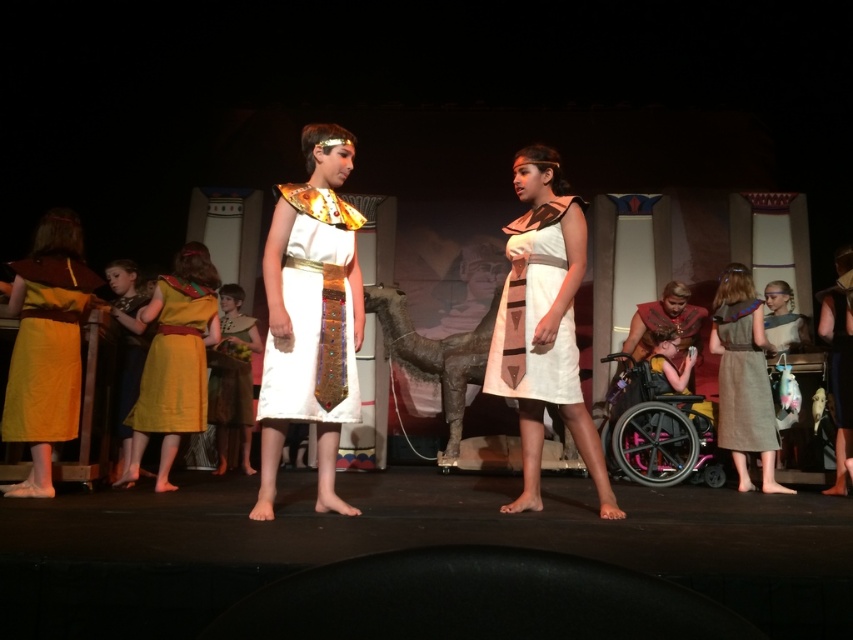
From the picture: You are a stagehand trying to place a prop on the stage. The prop needs to be placed exactly at the location of the matte yellow dress at left. What are the coordinates where you should place the prop?

The coordinates for the matte yellow dress at left are at point (47, 352), so the prop should be placed there.

You are an audience member sitting in the middle of the theater. You notice two dresses on the stage. The matte yellow dress at left and the brown textured dress at right. Which dress is higher up on the stage?

The matte yellow dress at left is located above the brown textured dress at right, so it is higher up on the stage.